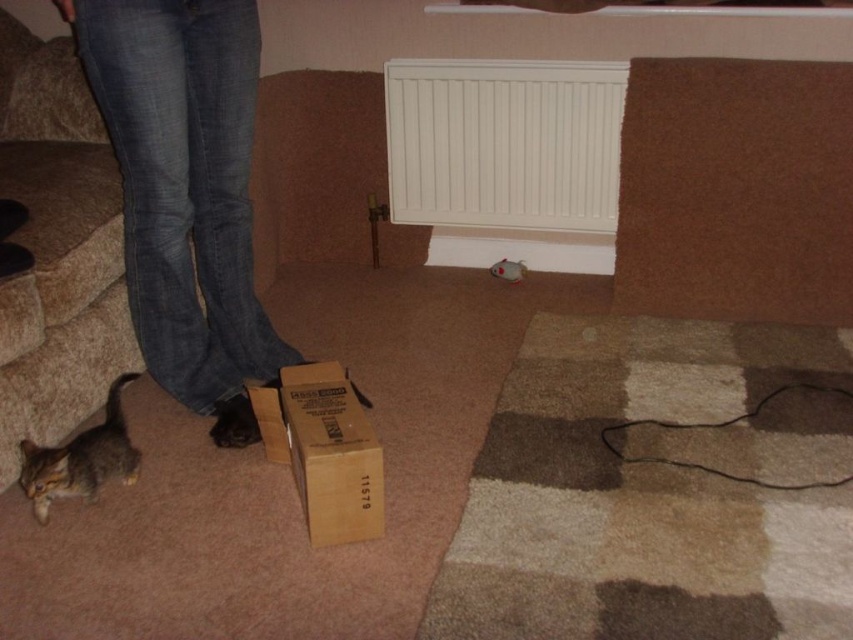
Question: Is white matte radiator at center to the left of brown cardboard box at lower center from the viewer's perspective?

Choices:
 (A) no
 (B) yes

Answer: (A)

Question: Which point is closer to the camera?

Choices:
 (A) brown cardboard box at lower center
 (B) tabby fur cat at lower left
 (C) white matte radiator at center
 (D) denim jeans at lower left

Answer: (A)

Question: Does white matte radiator at center come in front of tabby fur cat at lower left?

Choices:
 (A) yes
 (B) no

Answer: (B)

Question: Which point is closer to the camera?

Choices:
 (A) denim jeans at lower left
 (B) white matte radiator at center
 (C) tabby fur cat at lower left
 (D) brown cardboard box at lower center

Answer: (D)

Question: Is white matte radiator at center bigger than brown cardboard box at lower center?

Choices:
 (A) yes
 (B) no

Answer: (A)

Question: Which object is the closest to the tabby fur cat at lower left?

Choices:
 (A) brown cardboard box at lower center
 (B) white matte radiator at center
 (C) denim jeans at lower left

Answer: (C)